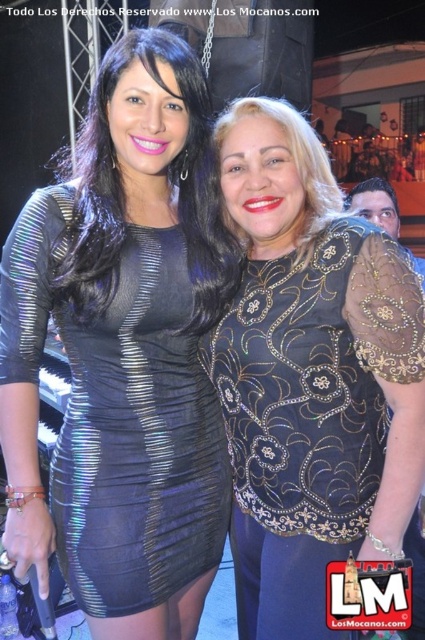
Image resolution: width=425 pixels, height=640 pixels. What do you see at coordinates (124, 353) in the screenshot?
I see `metallic black dress at center` at bounding box center [124, 353].

Does metallic black dress at center have a lesser height compared to black sequined blouse at right?

No.

In order to click on metallic black dress at center in this screenshot , I will do `click(124, 353)`.

Find the location of a particular element. The height and width of the screenshot is (640, 425). metallic black dress at center is located at coordinates (124, 353).